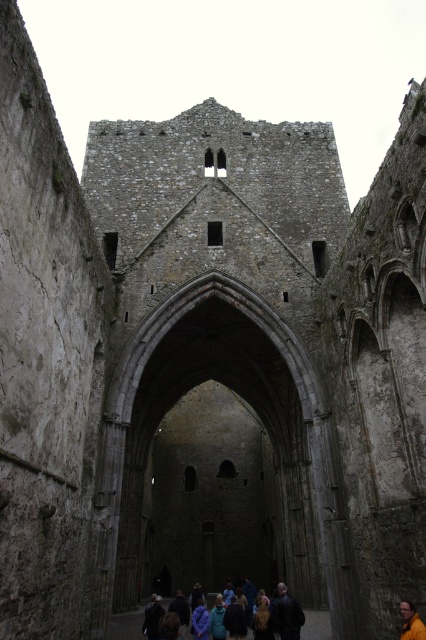
Consider the image. You are a medieval knight exploring this ancient stone structure. You see a dark blue jacket at lower center and a dark brown leather jacket at center. Which jacket is positioned to the left when viewed from your perspective?

The dark blue jacket at lower center is positioned to the left of the dark brown leather jacket at center.

You are standing in the medieval stone structure and want to move from the dark blue jacket at lower center to the yellow fabric person at center. Which direction should you move to reach them?

The dark blue jacket at lower center is to the left of the yellow fabric person at center, so you should move to the right to reach them.

You are standing in a medieval stone structure and see a dark blue jacket at lower center. Where exactly is the dark blue jacket located in terms of coordinates?

The dark blue jacket at lower center is located at coordinates point [180,608].